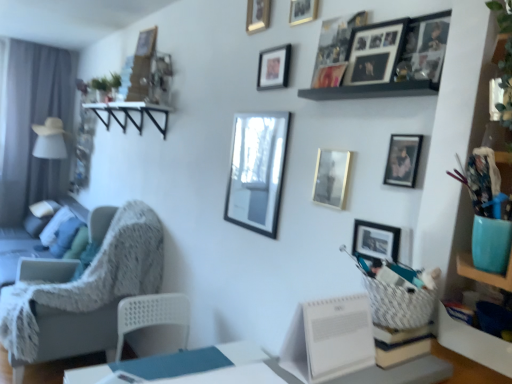
Question: From the image's perspective, is textured gray chair at left on matte black picture frame at center, placed as the 6th picture frame when sorted from top to bottom?

Choices:
 (A) no
 (B) yes

Answer: (A)

Question: Is textured gray chair at left behind matte black picture frame at center, arranged as the fourth picture frame when ordered from the bottom?

Choices:
 (A) yes
 (B) no

Answer: (A)

Question: Does textured gray chair at left have a greater height compared to matte black picture frame at center, arranged as the fourth picture frame when ordered from the bottom?

Choices:
 (A) yes
 (B) no

Answer: (A)

Question: Can we say textured gray chair at left lies outside matte black picture frame at center, placed as the 6th picture frame when sorted from top to bottom?

Choices:
 (A) no
 (B) yes

Answer: (B)

Question: Is textured gray chair at left shorter than matte black picture frame at center, placed as the 6th picture frame when sorted from top to bottom?

Choices:
 (A) yes
 (B) no

Answer: (B)

Question: Is metallic gold picture frame at upper center, the fourth picture frame in the top-to-bottom sequence, bigger or smaller than white plastic table at lower center?

Choices:
 (A) big
 (B) small

Answer: (B)

Question: In terms of height, does metallic gold picture frame at upper center, the fourth picture frame in the top-to-bottom sequence, look taller or shorter compared to white plastic table at lower center?

Choices:
 (A) tall
 (B) short

Answer: (A)

Question: Is metallic gold picture frame at upper center, which is the 6th picture frame in bottom-to-top order, spatially inside white plastic table at lower center, or outside of it?

Choices:
 (A) inside
 (B) outside

Answer: (B)

Question: From a real-world perspective, is metallic gold picture frame at upper center, which is the 6th picture frame in bottom-to-top order, physically located above or below white plastic table at lower center?

Choices:
 (A) below
 (B) above

Answer: (B)

Question: Is metallic gold picture frame at upper center, acting as the third picture frame starting from the top, in front of or behind metallic gold picture frame at upper center, which is the 6th picture frame in bottom-to-top order, in the image?

Choices:
 (A) behind
 (B) front

Answer: (A)

Question: In terms of width, does metallic gold picture frame at upper center, acting as the third picture frame starting from the top, look wider or thinner when compared to metallic gold picture frame at upper center, the fourth picture frame in the top-to-bottom sequence?

Choices:
 (A) thin
 (B) wide

Answer: (A)

Question: Visually, is metallic gold picture frame at upper center, acting as the third picture frame starting from the top, positioned to the left or to the right of metallic gold picture frame at upper center, the fourth picture frame in the top-to-bottom sequence?

Choices:
 (A) left
 (B) right

Answer: (A)

Question: Is metallic gold picture frame at upper center, which is the seventh picture frame from bottom to top, inside the boundaries of metallic gold picture frame at upper center, the fourth picture frame in the top-to-bottom sequence, or outside?

Choices:
 (A) outside
 (B) inside

Answer: (A)

Question: Looking at the image, does textured gray chair at left seem bigger or smaller compared to metallic gold picture frame at upper center, acting as the third picture frame starting from the top?

Choices:
 (A) small
 (B) big

Answer: (B)

Question: From their relative heights in the image, would you say textured gray chair at left is taller or shorter than metallic gold picture frame at upper center, acting as the third picture frame starting from the top?

Choices:
 (A) short
 (B) tall

Answer: (B)